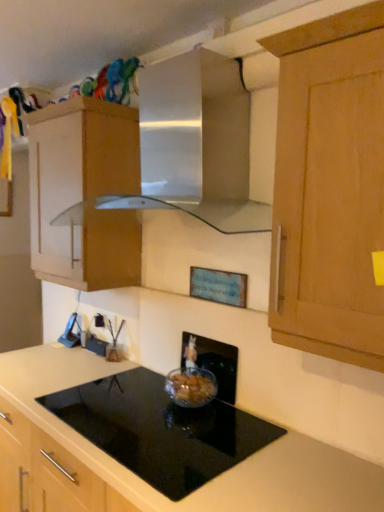
Question: Considering the relative sizes of black plastic electric outlet at lower left and wooden cabinet at upper left in the image provided, is black plastic electric outlet at lower left smaller than wooden cabinet at upper left?

Choices:
 (A) yes
 (B) no

Answer: (A)

Question: From the image's perspective, does black plastic electric outlet at lower left appear lower than wooden cabinet at upper left?

Choices:
 (A) no
 (B) yes

Answer: (B)

Question: Is black plastic electric outlet at lower left further to camera compared to wooden cabinet at upper left?

Choices:
 (A) no
 (B) yes

Answer: (B)

Question: Is black plastic electric outlet at lower left to the right of wooden cabinet at upper left from the viewer's perspective?

Choices:
 (A) no
 (B) yes

Answer: (B)

Question: Would you say black plastic electric outlet at lower left contains wooden cabinet at upper left?

Choices:
 (A) yes
 (B) no

Answer: (B)

Question: Is black plastic electric outlet at lower left turned away from wooden cabinet at upper left?

Choices:
 (A) no
 (B) yes

Answer: (A)

Question: From a real-world perspective, is black plastic electric outlet at lower left under black glass cooktop at center?

Choices:
 (A) yes
 (B) no

Answer: (B)

Question: From the image's perspective, is black plastic electric outlet at lower left beneath black glass cooktop at center?

Choices:
 (A) no
 (B) yes

Answer: (A)

Question: Could you tell me if black plastic electric outlet at lower left is facing black glass cooktop at center?

Choices:
 (A) yes
 (B) no

Answer: (B)

Question: Is black plastic electric outlet at lower left positioned before black glass cooktop at center?

Choices:
 (A) no
 (B) yes

Answer: (A)

Question: Is black plastic electric outlet at lower left turned away from black glass cooktop at center?

Choices:
 (A) yes
 (B) no

Answer: (B)

Question: Are black plastic electric outlet at lower left and black glass cooktop at center beside each other?

Choices:
 (A) yes
 (B) no

Answer: (B)

Question: Are clear glass bowl at center and black plastic electric outlet at lower left far apart?

Choices:
 (A) yes
 (B) no

Answer: (B)